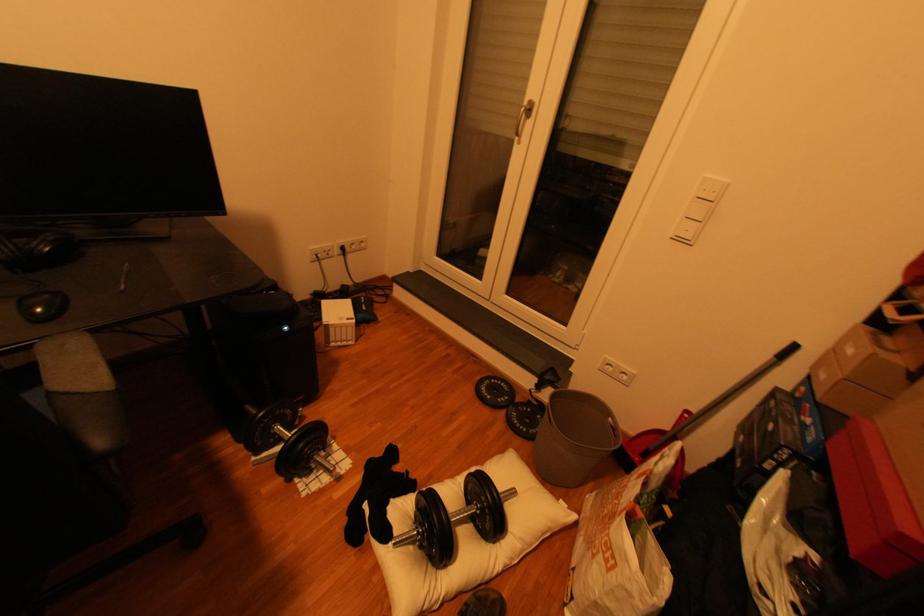
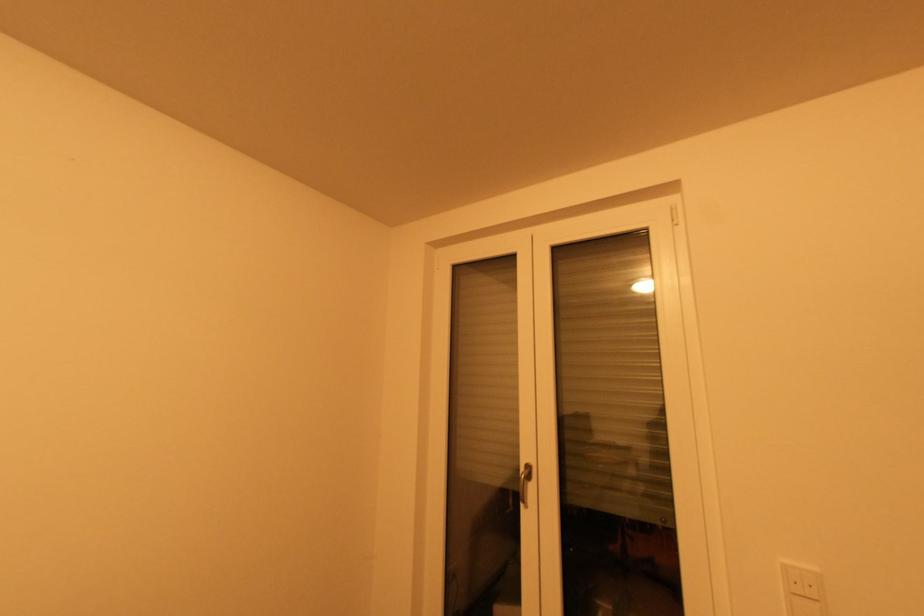
Question: How did the camera likely rotate?

Choices:
 (A) Left
 (B) Right
 (C) Up
 (D) Down

Answer: (C)